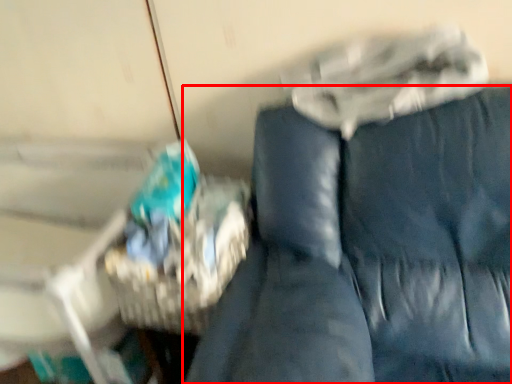
Question: From the image's perspective, considering the relative positions of furniture (annotated by the red box) and basket in the image provided, where is furniture (annotated by the red box) located with respect to the staircase?

Choices:
 (A) above
 (B) below

Answer: (B)